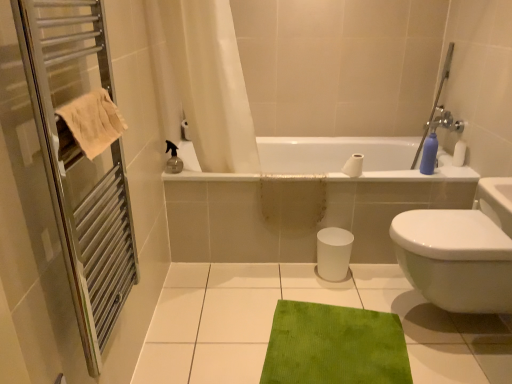
Image resolution: width=512 pixels, height=384 pixels. I want to click on vacant area located to the right-hand side of white matte toilet paper at upper center, so click(x=378, y=176).